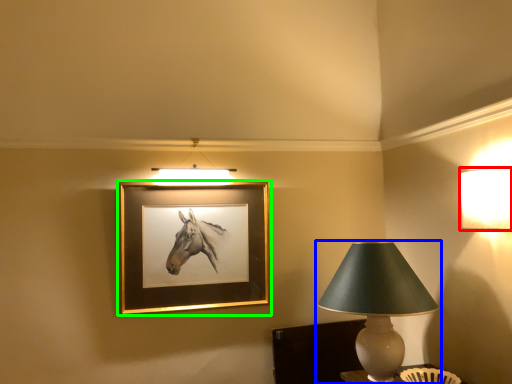
Question: Based on their relative distances, which object is nearer to lamp (highlighted by a red box)? Choose from lamp (highlighted by a blue box) and picture frame (highlighted by a green box).

Choices:
 (A) lamp
 (B) picture frame

Answer: (A)